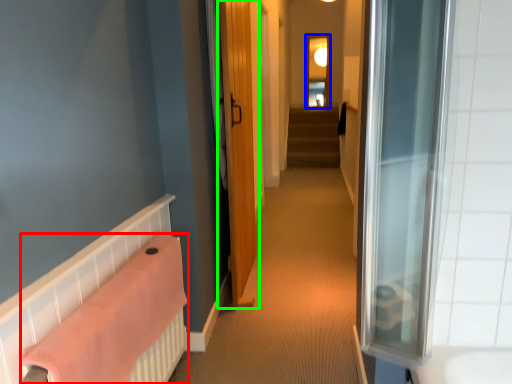
Question: Based on their relative distances, which object is nearer to bath towel (highlighted by a red box)? Choose from window (highlighted by a blue box) and door (highlighted by a green box).

Choices:
 (A) window
 (B) door

Answer: (B)